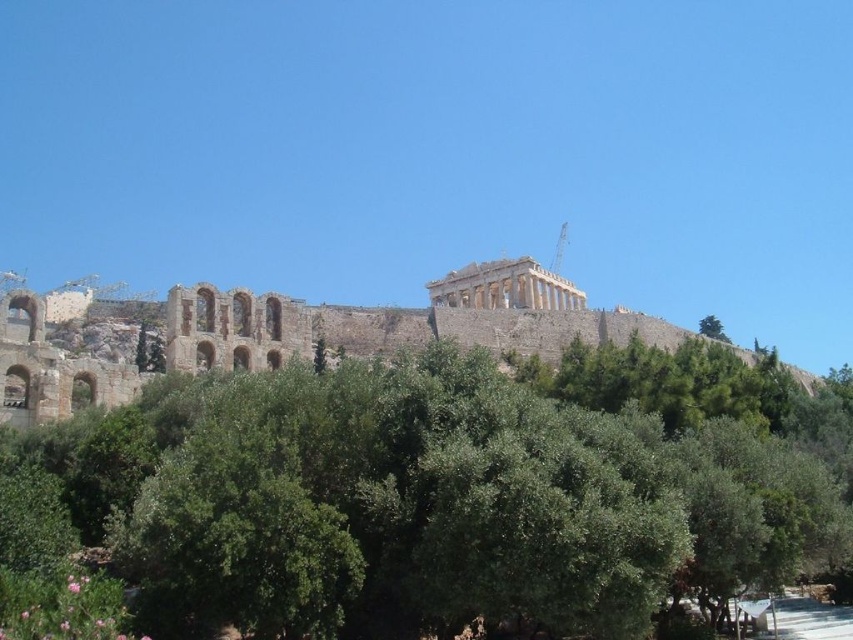
Question: Is green leafy tree at center thinner than green leafy tree at upper center?

Choices:
 (A) yes
 (B) no

Answer: (B)

Question: Is green leafy tree at center below green leafy tree at upper center?

Choices:
 (A) yes
 (B) no

Answer: (A)

Question: Which of the following is the farthest from the observer?

Choices:
 (A) (703, 324)
 (B) (44, 568)

Answer: (A)

Question: Which object is closer to the camera taking this photo?

Choices:
 (A) green leafy tree at center
 (B) stone amphitheater at center

Answer: (A)

Question: Considering the real-world distances, which object is closest to the stone amphitheater at center?

Choices:
 (A) green leafy tree at upper center
 (B) green leafy tree at center

Answer: (B)

Question: Can you confirm if green leafy tree at center is positioned to the left of green leafy tree at upper center?

Choices:
 (A) no
 (B) yes

Answer: (B)